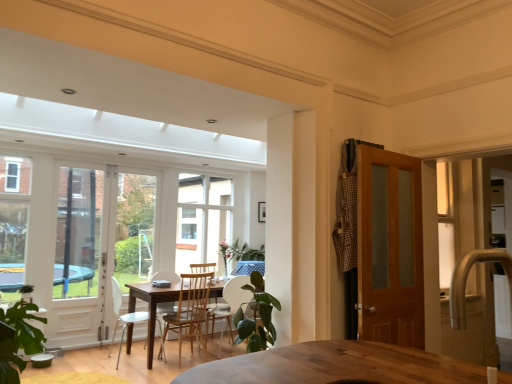
Image resolution: width=512 pixels, height=384 pixels. Describe the element at coordinates (229, 306) in the screenshot. I see `wooden chair at center, marked as the 1th chair in a right-to-left arrangement` at that location.

What do you see at coordinates (151, 307) in the screenshot? The image size is (512, 384). I see `light brown wooden table at center` at bounding box center [151, 307].

The width and height of the screenshot is (512, 384). Find the location of `light brown wooden table at center`. light brown wooden table at center is located at coordinates (151, 307).

Identify the location of gold textured faucet at right. The image size is (512, 384). (466, 280).

In order to face wooden door at right, should I rotate leftwards or rightwards?

Turn right by 17.693 degrees to look at wooden door at right.

Image resolution: width=512 pixels, height=384 pixels. I want to click on metallic silver table at center, so tap(250, 267).

Could you tell me if white glass screen door at left is facing wooden door at right?

No, white glass screen door at left is not facing towards wooden door at right.

Would you say wooden door at right is part of white glass screen door at left's contents?

No, wooden door at right is not inside white glass screen door at left.

Considering the positions of point (68, 213) and point (379, 271), is point (68, 213) closer or farther from the camera than point (379, 271)?

Clearly, point (68, 213) is more distant from the camera than point (379, 271).

Consider the image. Which of these two, wooden chair at center, marked as the 1th chair in a right-to-left arrangement, or white plastic chair at center, the 1th chair from the left, is bigger?

white plastic chair at center, the 1th chair from the left, is bigger.

From the image's perspective, relative to white plastic chair at center, acting as the third chair starting from the right, is wooden chair at center, the third chair when ordered from left to right, above or below?

Clearly, from the image's perspective, wooden chair at center, the third chair when ordered from left to right, is below white plastic chair at center, acting as the third chair starting from the right.

Based on the photo, considering the sizes of wooden chair at center, marked as the 1th chair in a right-to-left arrangement, and white plastic chair at center, acting as the third chair starting from the right, in the image, is wooden chair at center, marked as the 1th chair in a right-to-left arrangement, taller or shorter than white plastic chair at center, acting as the third chair starting from the right,?

In the image, wooden chair at center, marked as the 1th chair in a right-to-left arrangement, appears to be taller than white plastic chair at center, acting as the third chair starting from the right.

Would you say light brown wooden table at center is to the left or to the right of metallic silver table at center in the picture?

light brown wooden table at center is positioned on metallic silver table at center's left side.

The height and width of the screenshot is (384, 512). I want to click on table above the light brown wooden table at center (from a real-world perspective), so (x=250, y=267).

From the image's perspective, is light brown wooden table at center over metallic silver table at center?

No, from the image's perspective, light brown wooden table at center is not above metallic silver table at center.

Which point is more forward, (130, 289) or (261, 263)?

The point (130, 289) is more forward.

From the image's perspective, who appears lower, metallic silver table at center or white glass window at center?

metallic silver table at center, from the image's perspective.

Considering the sizes of objects metallic silver table at center and white glass window at center in the image provided, who is bigger, metallic silver table at center or white glass window at center?

With larger size is white glass window at center.

Is point (260, 267) closer or farther from the camera than point (179, 182)?

Point (260, 267).

Can you confirm if metallic silver table at center is shorter than white glass window at center?

Yes, metallic silver table at center is shorter than white glass window at center.

This screenshot has width=512, height=384. I want to click on window above the green leafy plant at center (from a real-world perspective), so click(203, 220).

Which is closer, [273,344] or [212,239]?

Point [273,344] is closer to the camera than point [212,239].

Considering the relative positions of green leafy plant at center and white glass window at center in the image provided, is green leafy plant at center in front of white glass window at center?

Yes, it is.

Choose the correct answer: Is green leafy plant at center inside white glass window at center or outside it?

green leafy plant at center is spatially situated outside white glass window at center.

Is wooden chair at center, marked as the 2th chair in a right-to-left arrangement, shorter than metallic silver table at center?

Incorrect, the height of wooden chair at center, marked as the 2th chair in a right-to-left arrangement, does not fall short of that of metallic silver table at center.

From a real-world perspective, between wooden chair at center, marked as the 2th chair in a right-to-left arrangement, and metallic silver table at center, who is vertically lower?

wooden chair at center, marked as the 2th chair in a right-to-left arrangement, is physically lower.

From a real-world perspective, which chair is the 2nd one underneath the metallic silver table at center? Please provide its 2D coordinates.

[(189, 311)]

Is wooden chair at center, which appears as the 2th chair when viewed from the left, in front of metallic silver table at center?

Yes, it is.

From a real-world perspective, is wooden chair at center, the third chair when ordered from left to right, on top of wooden door at right?

No, from a real-world perspective, wooden chair at center, the third chair when ordered from left to right, is not above wooden door at right.

Can you tell me how much wooden chair at center, the third chair when ordered from left to right, and wooden door at right differ in facing direction?

The facing directions of wooden chair at center, the third chair when ordered from left to right, and wooden door at right are 180 degrees apart.

Which is closer, (x=242, y=294) or (x=370, y=157)?

Point (x=242, y=294) is farther from the camera than point (x=370, y=157).

Which object is thinner, wooden chair at center, marked as the 1th chair in a right-to-left arrangement, or wooden door at right?

wooden door at right.

Find the location of a particular element. door on the right of the white glass screen door at left is located at coordinates (390, 248).

Locate an element on the screen. The image size is (512, 384). the 2nd chair to the left of the wooden chair at center, marked as the 1th chair in a right-to-left arrangement, starting your count from the anchor is located at coordinates (123, 316).

Consider the image. Estimate the real-world distances between objects in this image. Which object is closer to white glass screen door at left, wooden chair at center, the third chair when ordered from left to right, or green leafy plant at center?

The object closer to white glass screen door at left is wooden chair at center, the third chair when ordered from left to right.

When comparing their distances from wooden chair at center, marked as the 1th chair in a right-to-left arrangement, does white plastic chair at center, acting as the third chair starting from the right, or green leafy plant at center seem closer?

white plastic chair at center, acting as the third chair starting from the right, is closer to wooden chair at center, marked as the 1th chair in a right-to-left arrangement.

Based on their spatial positions, is green leafy plant at center or gold textured faucet at right closer to metallic silver table at center?

The object closer to metallic silver table at center is green leafy plant at center.

Based on their spatial positions, is metallic silver table at center or wooden chair at center, marked as the 1th chair in a right-to-left arrangement, closer to gold textured faucet at right?

Based on the image, wooden chair at center, marked as the 1th chair in a right-to-left arrangement, appears to be nearer to gold textured faucet at right.

Consider the image. Considering their positions, is metallic silver table at center positioned closer to light brown wooden table at center than white glass window at center?

metallic silver table at center is closer to light brown wooden table at center.

Looking at this image, considering their positions, is gold textured faucet at right positioned further to white glass screen door at left than white plastic chair at center, the 1th chair from the left?

gold textured faucet at right.

From the image, which object appears to be farther from light brown wooden table at center, white plastic chair at center, the 1th chair from the left, or white glass window at center?

white glass window at center lies further to light brown wooden table at center than the other object.

Which object lies further to the anchor point wooden door at right, gold textured faucet at right or white plastic chair at center, acting as the third chair starting from the right?

white plastic chair at center, acting as the third chair starting from the right, lies further to wooden door at right than the other object.

Where is `kitchen & dining room table situated between wooden chair at center, marked as the 2th chair in a right-to-left arrangement, and wooden chair at center, the third chair when ordered from left to right, from left to right`? This screenshot has height=384, width=512. kitchen & dining room table situated between wooden chair at center, marked as the 2th chair in a right-to-left arrangement, and wooden chair at center, the third chair when ordered from left to right, from left to right is located at coordinates (151, 307).

Find the location of a particular element. This screenshot has width=512, height=384. houseplant between wooden door at right and light brown wooden table at center from front to back is located at coordinates (255, 317).

In order to click on houseplant between white plastic chair at center, the 1th chair from the left, and wooden door at right in this screenshot , I will do 255,317.

You are a GUI agent. You are given a task and a screenshot of the screen. Output one action in this format:
    pyautogui.click(x=<x>, y=<y>)
    Task: Click on the kitchen & dining room table between white glass screen door at left and wooden door at right from left to right
    This screenshot has height=384, width=512.
    Given the screenshot: What is the action you would take?
    pyautogui.click(x=151, y=307)